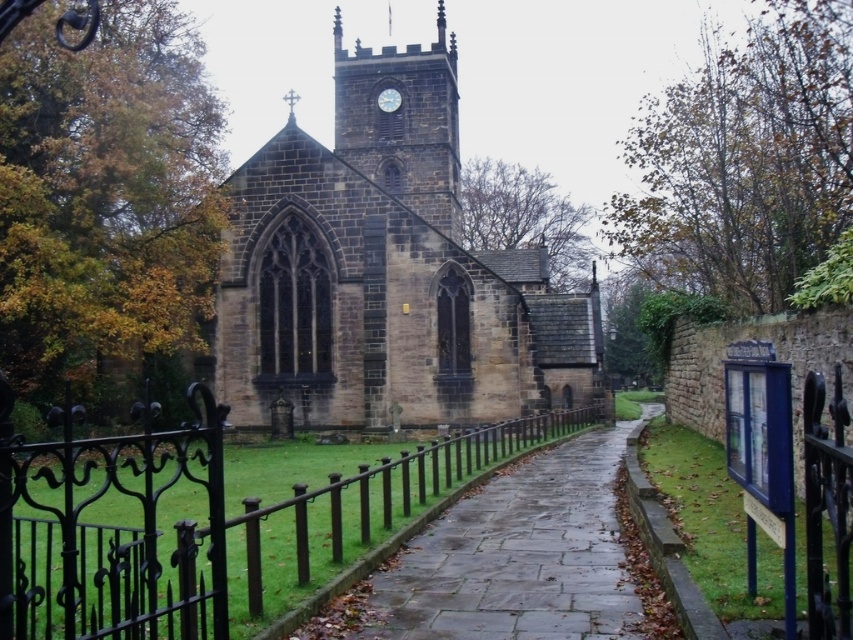
You are a tour guide explaining the church to visitors. You want to mention the size relationship between the paved stone path at center and the white stone clock at upper center. How would you describe their sizes?

The paved stone path at center is larger in size than the white stone clock at upper center.

You are standing at the entrance of the historic stone church and want to walk towards the point that is closer to you. Which point should you head towards, point (374,492) or point (392,100)?

You should head towards point (374,492) because it is closer to the viewer than point (392,100).